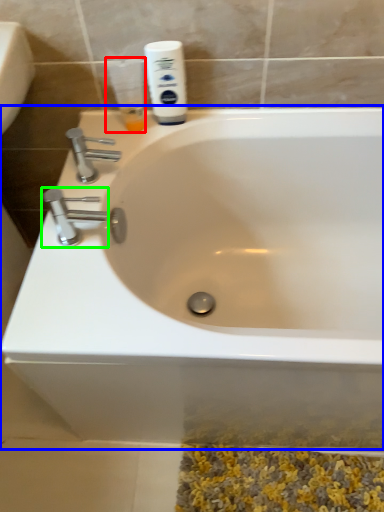
Question: Which object is positioned closest to mouthwash (highlighted by a red box)? Select from bathtub (highlighted by a blue box) and tap (highlighted by a green box).

Choices:
 (A) bathtub
 (B) tap

Answer: (B)